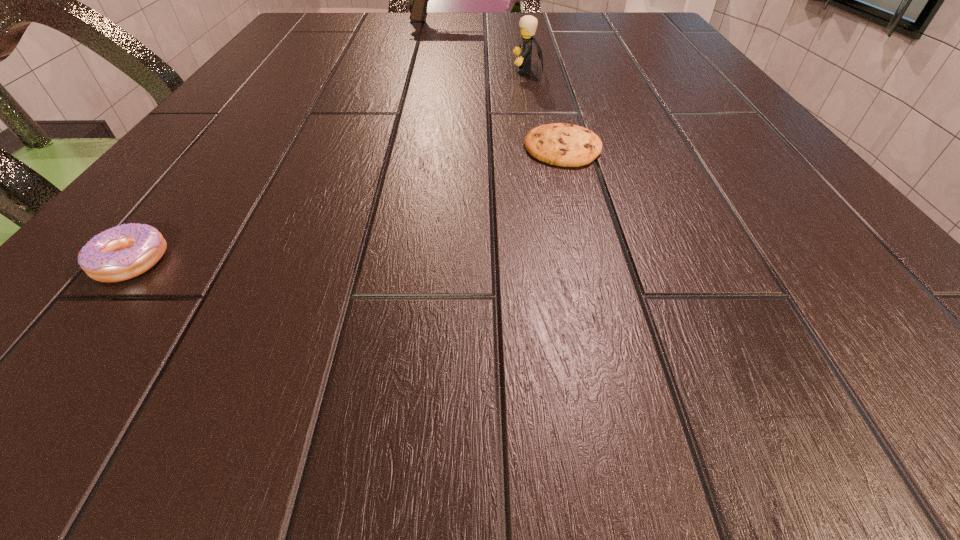
Where is `vacant area at the far right corner`? This screenshot has height=540, width=960. vacant area at the far right corner is located at coordinates (623, 39).

Locate an element on the screen. vacant space at the near right corner of the desktop is located at coordinates (935, 394).

Locate an element on the screen. This screenshot has height=540, width=960. vacant space in between the second nearest object and the second farthest object is located at coordinates (545, 109).

This screenshot has height=540, width=960. In order to click on vacant area that lies between the doughnut and the shortest object in this screenshot , I will do `click(347, 204)`.

I want to click on empty space that is in between the third nearest object and the third farthest object, so click(545, 109).

What are the coordinates of `free space between the leftmost object and the farthest object` in the screenshot? It's located at point(287,141).

Find the location of `vacant space that is in between the third object from right to left and the shortest object`. vacant space that is in between the third object from right to left and the shortest object is located at coordinates (502, 84).

Where is `free space between the nearest object and the cookie`? This screenshot has height=540, width=960. free space between the nearest object and the cookie is located at coordinates (347, 204).

Find the location of a particular element. free point between the second farthest object and the leftmost object is located at coordinates [x=329, y=166].

Locate an element on the screen. unoccupied position between the nearest object and the second farthest object is located at coordinates (329, 166).